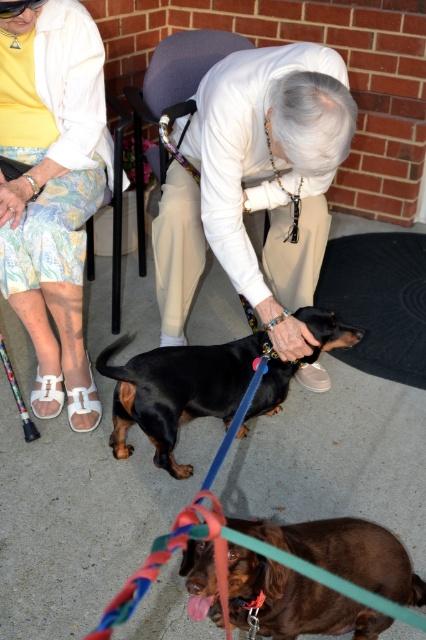
Question: Among these objects, which one is nearest to the camera?

Choices:
 (A) brown glossy dog at lower center
 (B) smooth black dog at center
 (C) black smooth dachshund at center

Answer: (A)

Question: Considering the relative positions of smooth black dog at center and black smooth dachshund at center in the image provided, where is smooth black dog at center located with respect to black smooth dachshund at center?

Choices:
 (A) right
 (B) left

Answer: (A)

Question: Can you confirm if white floral skirt at lower left is smaller than brown glossy dog at lower center?

Choices:
 (A) no
 (B) yes

Answer: (A)

Question: Which object is positioned farthest from the black smooth dachshund at center?

Choices:
 (A) white floral skirt at lower left
 (B) brown glossy dog at lower center
 (C) smooth black dog at center

Answer: (B)

Question: Can you confirm if white floral skirt at lower left is smaller than brown glossy dog at lower center?

Choices:
 (A) no
 (B) yes

Answer: (A)

Question: Based on their relative distances, which object is farther from the black smooth dachshund at center?

Choices:
 (A) brown glossy dog at lower center
 (B) white floral skirt at lower left
 (C) smooth black dog at center

Answer: (A)